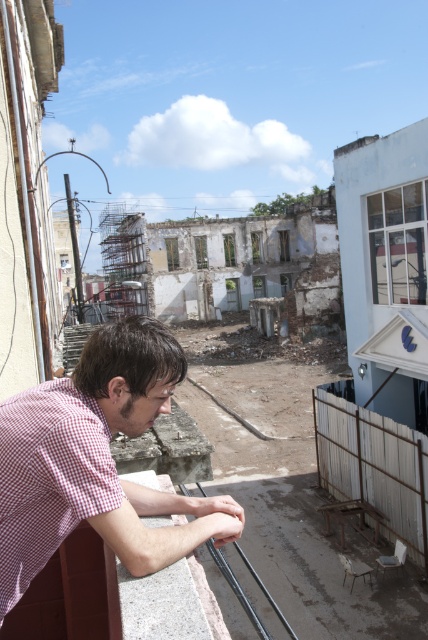
You are a construction worker standing on the gray concrete ledge at lower left and need to place a tool box on the red checkered shirt at lower left. Can you fit the tool box there without overhanging the ledge?

The red checkered shirt at lower left might be wider than gray concrete ledge at lower left, so there is a possibility that the tool box could fit without overhanging, but there is uncertainty due to the comparative width.